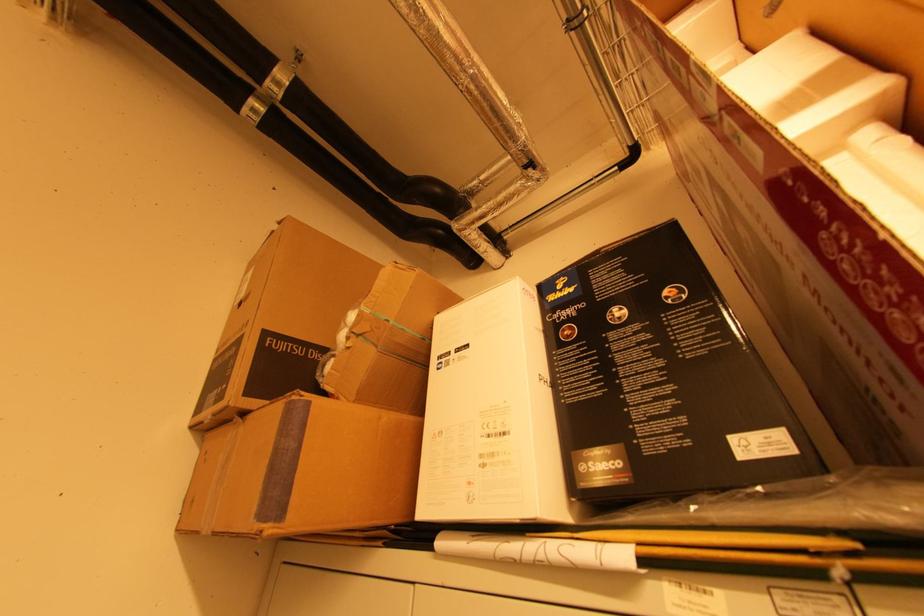
At what (x,y) coordinates should I click in order to perform the action: click on cabinet handle. Please return your answer as a coordinate pair (x, y). The height and width of the screenshot is (616, 924). Looking at the image, I should click on (482, 605).